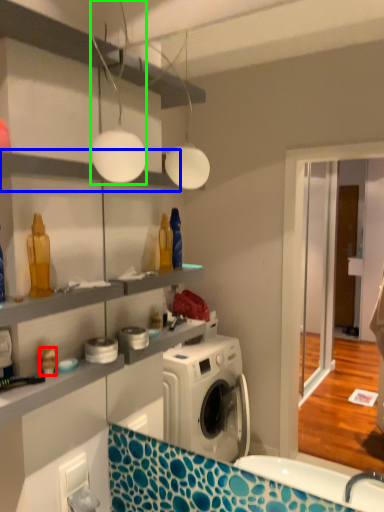
Question: Which object is positioned closest to toy (highlighted by a red box)? Select from shelf (highlighted by a blue box) and light fixture (highlighted by a green box).

Choices:
 (A) shelf
 (B) light fixture

Answer: (A)